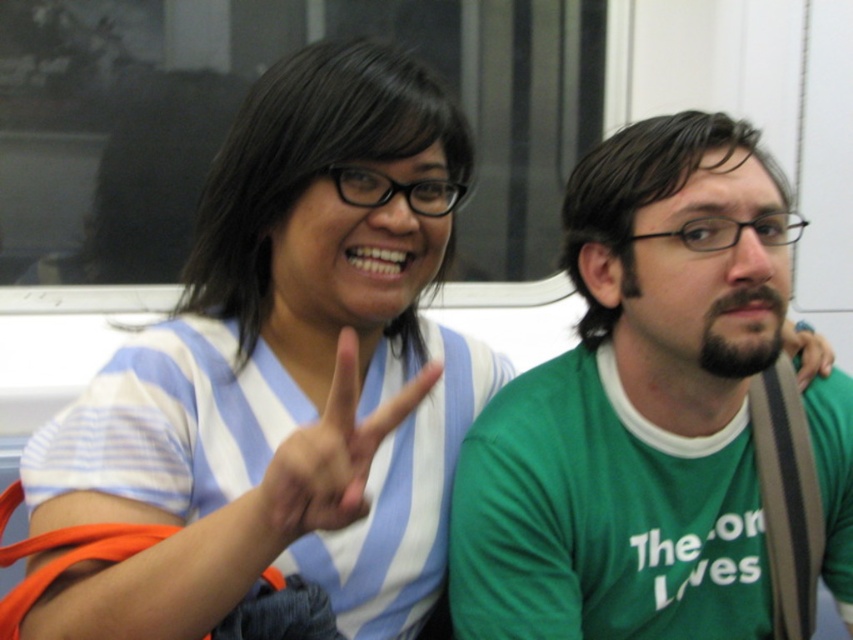
Which is behind, point (583, 424) or point (339, 385)?

The point (583, 424) is behind.

Measure the distance between green cotton t-shirt at center and white matte hand at center.

They are 20.09 inches apart.

This screenshot has height=640, width=853. Find the location of `green cotton t-shirt at center`. green cotton t-shirt at center is located at coordinates (637, 406).

Does green cotton t-shirt at center have a smaller size compared to green fabric hand at right?

No, green cotton t-shirt at center is not smaller than green fabric hand at right.

Who is lower down, green cotton t-shirt at center or green fabric hand at right?

green cotton t-shirt at center

This screenshot has height=640, width=853. What do you see at coordinates (637, 406) in the screenshot? I see `green cotton t-shirt at center` at bounding box center [637, 406].

Locate an element on the screen. The height and width of the screenshot is (640, 853). green cotton t-shirt at center is located at coordinates (637, 406).

Does blue striped shirt at upper left have a greater width compared to white matte hand at center?

Yes.

What do you see at coordinates (285, 372) in the screenshot? The height and width of the screenshot is (640, 853). I see `blue striped shirt at upper left` at bounding box center [285, 372].

Is point (427, 596) more distant than point (273, 493)?

Yes, point (427, 596) is farther from viewer.

The height and width of the screenshot is (640, 853). Identify the location of blue striped shirt at upper left. (285, 372).